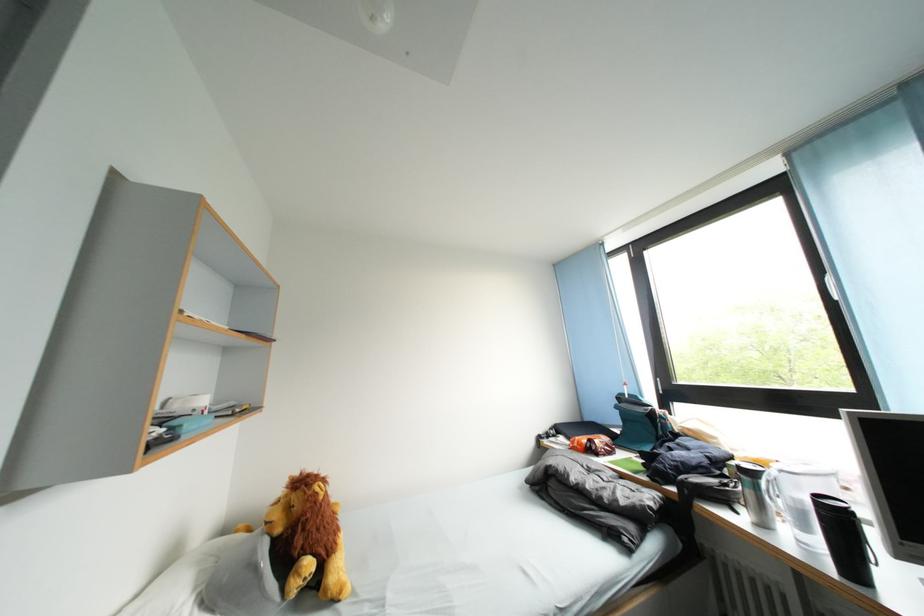
The image size is (924, 616). In order to click on clear pitcher in this screenshot , I will do `click(799, 496)`.